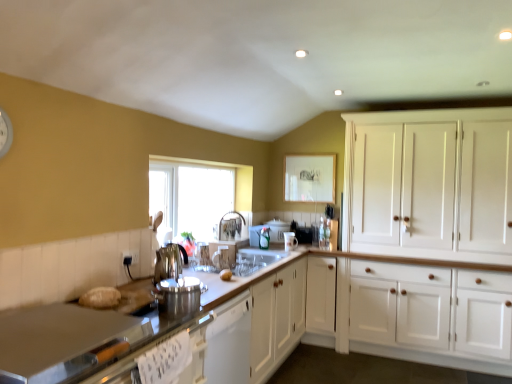
You are a GUI agent. You are given a task and a screenshot of the screen. Output one action in this format:
    pyautogui.click(x=<x>, y=<y>)
    Task: Click on the free space to the back side of bread matte at center
    
    Given the screenshot: What is the action you would take?
    pyautogui.click(x=232, y=271)